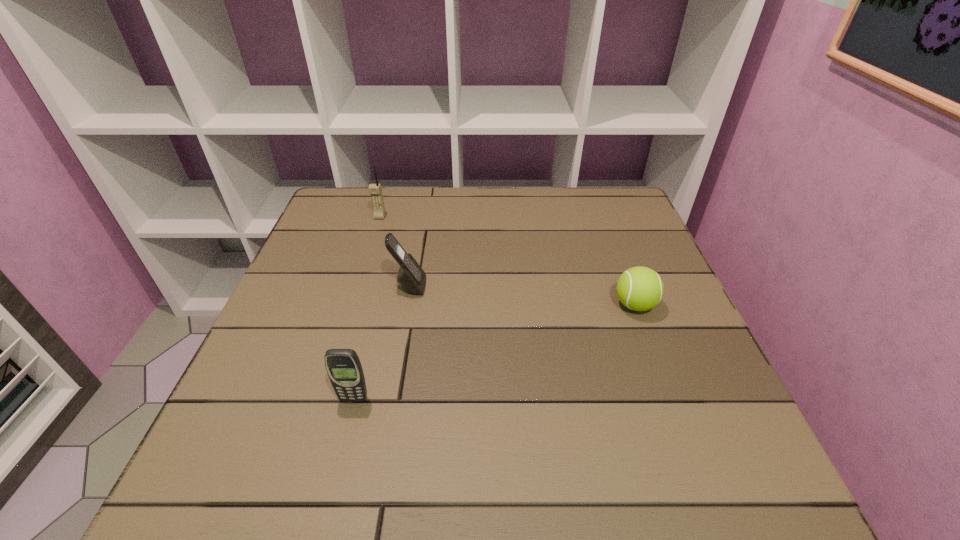
The width and height of the screenshot is (960, 540). Identify the location of the farthest object. (375, 190).

Identify the location of the leftmost object. (375, 190).

This screenshot has height=540, width=960. I want to click on the second nearest cellular telephone, so click(411, 277).

Where is `the nearest cellular telephone`? the nearest cellular telephone is located at coordinates (343, 366).

You are a GUI agent. You are given a task and a screenshot of the screen. Output one action in this format:
    pyautogui.click(x=<x>, y=<y>)
    Task: Click on the shortest object
    This screenshot has width=960, height=540.
    Given the screenshot: What is the action you would take?
    pyautogui.click(x=639, y=288)

This screenshot has width=960, height=540. Identify the location of tennis ball. (639, 288).

In order to click on vacant area situated on the front of the leftmost cellular telephone, where the keypad is located in this screenshot , I will do `click(351, 309)`.

I want to click on blank space located 0.060m on the front-facing side of the second nearest cellular telephone, so click(x=451, y=286).

Where is `vacant space located 0.170m on the screen of the nearest object`? The width and height of the screenshot is (960, 540). vacant space located 0.170m on the screen of the nearest object is located at coordinates (328, 501).

Find the location of a particular element. The image size is (960, 540). vacant point located on the front of the tennis ball is located at coordinates (708, 501).